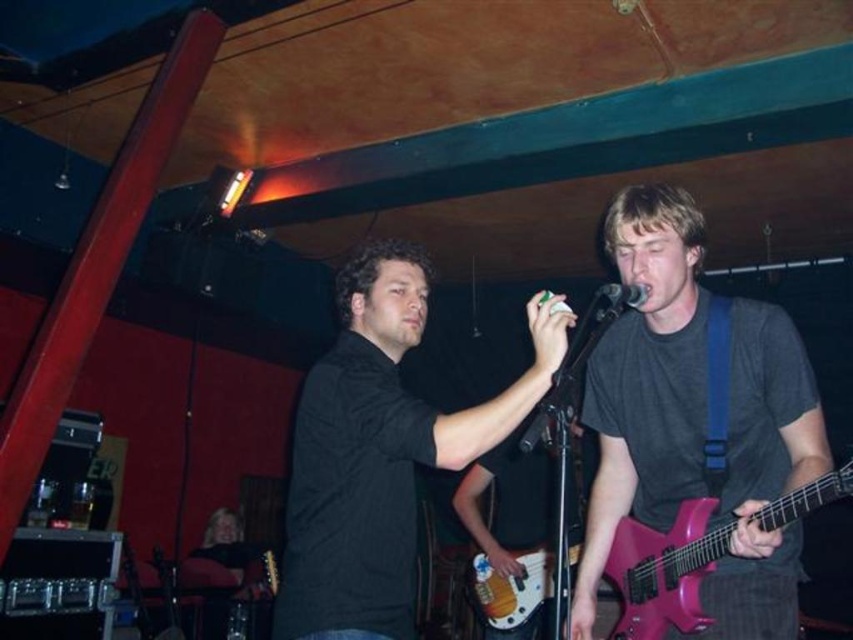
Question: Can you confirm if purple glossy guitar at center is wider than matte pink electric guitar at right?

Choices:
 (A) yes
 (B) no

Answer: (A)

Question: Which of the following is the closest to the observer?

Choices:
 (A) wooden electric guitar at center
 (B) black metallic microphone at upper center
 (C) matte pink electric guitar at right

Answer: (C)

Question: Which of the following is the farthest from the observer?

Choices:
 (A) black metallic microphone at upper center
 (B) matte black guitar at center
 (C) wooden electric guitar at center

Answer: (B)

Question: Which object is closer to the camera taking this photo?

Choices:
 (A) wooden electric guitar at center
 (B) black matte shirt at center
 (C) purple glossy guitar at center
 (D) matte pink electric guitar at right

Answer: (B)

Question: Does matte pink electric guitar at right appear on the right side of wooden electric guitar at center?

Choices:
 (A) yes
 (B) no

Answer: (A)

Question: Is the position of black matte shirt at center more distant than that of matte pink electric guitar at right?

Choices:
 (A) yes
 (B) no

Answer: (B)